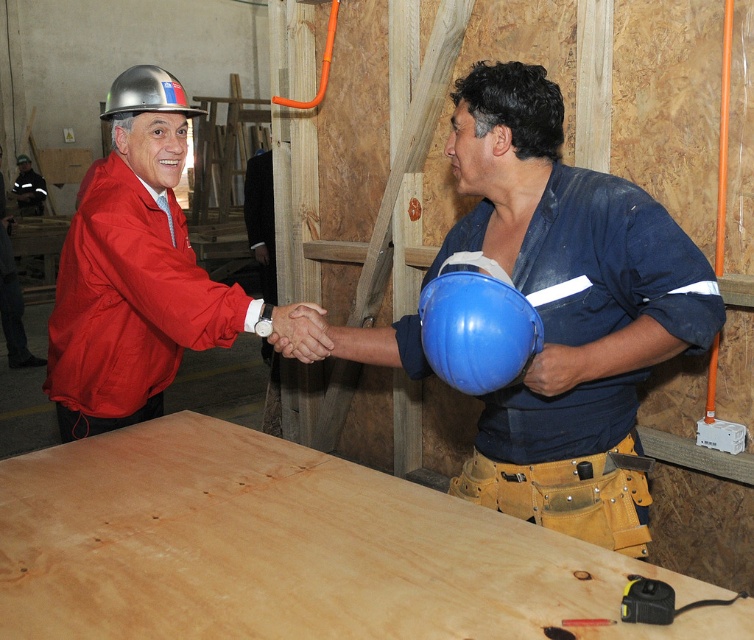
Can you confirm if blue matte helmet at center is positioned to the left of matte black helmet at upper left?

In fact, blue matte helmet at center is to the right of matte black helmet at upper left.

Does blue matte helmet at center have a lesser height compared to matte black helmet at upper left?

Correct, blue matte helmet at center is not as tall as matte black helmet at upper left.

Is point (480, 304) positioned behind point (23, 209)?

No, it is in front of (23, 209).

This screenshot has height=640, width=754. What are the coordinates of `blue matte helmet at center` in the screenshot? It's located at (477, 326).

Is blue matte helmet at center smaller than metallic hard hat at upper left?

Incorrect, blue matte helmet at center is not smaller in size than metallic hard hat at upper left.

Describe the element at coordinates (477, 326) in the screenshot. I see `blue matte helmet at center` at that location.

Locate an element on the screen. The width and height of the screenshot is (754, 640). blue matte helmet at center is located at coordinates (477, 326).

What do you see at coordinates (290, 548) in the screenshot? I see `natural wood plywood at center` at bounding box center [290, 548].

Does point (170, 561) come closer to viewer compared to point (38, 179)?

That is True.

Find the location of `natural wood plywood at center`. natural wood plywood at center is located at coordinates (290, 548).